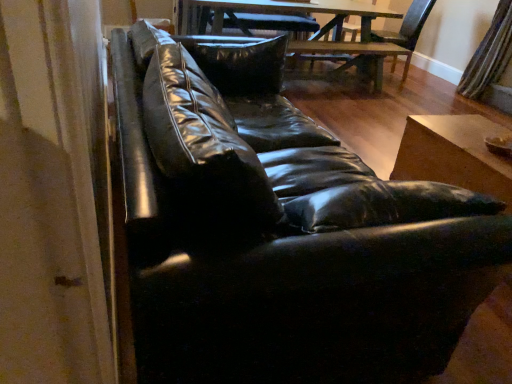
Question: From a real-world perspective, is wooden table at center, which ranks as the first table in back-to-front order, physically above striped fabric curtain at right?

Choices:
 (A) yes
 (B) no

Answer: (B)

Question: Is wooden table at center, which is the 2th table from bottom to top, to the right of striped fabric curtain at right from the viewer's perspective?

Choices:
 (A) yes
 (B) no

Answer: (B)

Question: Is wooden table at center, which ranks as the first table in back-to-front order, located outside striped fabric curtain at right?

Choices:
 (A) no
 (B) yes

Answer: (B)

Question: Considering the relative sizes of wooden table at center, which ranks as the first table in back-to-front order, and striped fabric curtain at right in the image provided, is wooden table at center, which ranks as the first table in back-to-front order, shorter than striped fabric curtain at right?

Choices:
 (A) no
 (B) yes

Answer: (B)

Question: Does wooden table at center, which is the 2th table from front to back, have a smaller size compared to striped fabric curtain at right?

Choices:
 (A) no
 (B) yes

Answer: (A)

Question: Choose the correct answer: Is wooden table at center, which is the 2th table from front to back, inside dark wood swivel chair at center or outside it?

Choices:
 (A) outside
 (B) inside

Answer: (A)

Question: Considering the positions of wooden table at center, acting as the 1th table starting from the top, and dark wood swivel chair at center in the image, is wooden table at center, acting as the 1th table starting from the top, bigger or smaller than dark wood swivel chair at center?

Choices:
 (A) small
 (B) big

Answer: (B)

Question: In terms of width, does wooden table at center, acting as the 1th table starting from the top, look wider or thinner when compared to dark wood swivel chair at center?

Choices:
 (A) wide
 (B) thin

Answer: (A)

Question: From a real-world perspective, is wooden table at center, which is the 2th table from bottom to top, above or below dark wood swivel chair at center?

Choices:
 (A) below
 (B) above

Answer: (A)

Question: Considering the positions of wooden table at center, acting as the 1th table starting from the top, and striped fabric curtain at right in the image, is wooden table at center, acting as the 1th table starting from the top, taller or shorter than striped fabric curtain at right?

Choices:
 (A) short
 (B) tall

Answer: (A)

Question: From a real-world perspective, is wooden table at center, acting as the 1th table starting from the top, above or below striped fabric curtain at right?

Choices:
 (A) below
 (B) above

Answer: (A)

Question: Is wooden table at center, which ranks as the first table in back-to-front order, in front of or behind striped fabric curtain at right in the image?

Choices:
 (A) behind
 (B) front

Answer: (B)

Question: Is wooden table at center, acting as the 1th table starting from the top, inside the boundaries of striped fabric curtain at right, or outside?

Choices:
 (A) inside
 (B) outside

Answer: (B)

Question: From a real-world perspective, is wooden table at lower right, which is counted as the first table, starting from the front, above or below dark wood swivel chair at center?

Choices:
 (A) above
 (B) below

Answer: (B)

Question: Is wooden table at lower right, positioned as the second table in top-to-bottom order, to the left or to the right of dark wood swivel chair at center in the image?

Choices:
 (A) left
 (B) right

Answer: (A)